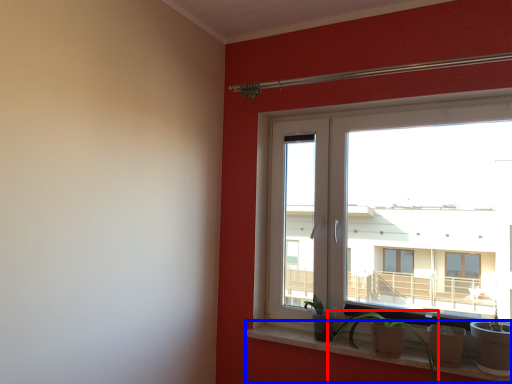
Question: Which object is further to the camera taking this photo, houseplant (highlighted by a red box) or window sill (highlighted by a blue box)?

Choices:
 (A) houseplant
 (B) window sill

Answer: (B)